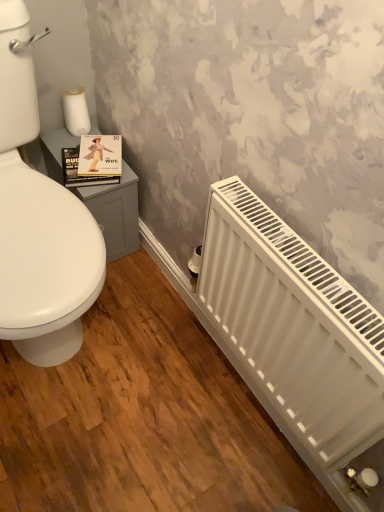
The image size is (384, 512). What do you see at coordinates (294, 325) in the screenshot?
I see `white matte radiator at lower right` at bounding box center [294, 325].

The width and height of the screenshot is (384, 512). What do you see at coordinates (93, 161) in the screenshot?
I see `matte paper book at upper left` at bounding box center [93, 161].

Locate an element on the screen. white matte radiator at lower right is located at coordinates (294, 325).

Consider the image. Is matte paper book at upper left not near white matte toilet paper at upper left?

They are positioned close to each other.

Which of these two, matte paper book at upper left or white matte toilet paper at upper left, stands taller?

white matte toilet paper at upper left is taller.

Between matte paper book at upper left and white matte toilet paper at upper left, which one has smaller width?

white matte toilet paper at upper left.

How much distance is there between matte paper book at upper left and white matte toilet paper at upper left?

A distance of 5.04 inches exists between matte paper book at upper left and white matte toilet paper at upper left.

Is white matte toilet paper at upper left in contact with matte paper book at upper left?

No.

From a real-world perspective, is white matte toilet paper at upper left beneath matte paper book at upper left?

No.

Does white matte toilet paper at upper left turn towards matte paper book at upper left?

Yes, white matte toilet paper at upper left is turned towards matte paper book at upper left.

Locate an element on the screen. toilet paper above the matte paper book at upper left (from the image's perspective) is located at coordinates (76, 111).

Is white matte radiator at lower right not within white matte toilet paper at upper left?

That's correct, white matte radiator at lower right is outside of white matte toilet paper at upper left.

From the image's perspective, does white matte radiator at lower right appear lower than white matte toilet paper at upper left?

Yes, from the image's perspective, white matte radiator at lower right is beneath white matte toilet paper at upper left.

Considering the sizes of objects white matte radiator at lower right and white matte toilet paper at upper left in the image provided, who is thinner, white matte radiator at lower right or white matte toilet paper at upper left?

Thinner between the two is white matte radiator at lower right.

Could you tell me if matte paper book at upper left is turned towards white matte radiator at lower right?

Yes.

Considering the points (81, 142) and (308, 407), which point is behind, point (81, 142) or point (308, 407)?

The point (81, 142) is more distant.

Is matte paper book at upper left outside of white matte radiator at lower right?

Indeed, matte paper book at upper left is completely outside white matte radiator at lower right.

Is matte paper book at upper left in front of white matte radiator at lower right?

That is False.

Is white matte radiator at lower right oriented towards matte paper book at upper left?

No, white matte radiator at lower right is not facing towards matte paper book at upper left.

How far apart are white matte radiator at lower right and matte paper book at upper left?

They are 25.30 inches apart.

What's the angular difference between white matte radiator at lower right and matte paper book at upper left's facing directions?

white matte radiator at lower right and matte paper book at upper left are facing 68.3 degrees away from each other.

Is there a large distance between white matte radiator at lower right and matte paper book at upper left?

Actually, white matte radiator at lower right and matte paper book at upper left are a little close together.

Would you say white matte toilet paper at upper left is outside white matte radiator at lower right?

That's correct, white matte toilet paper at upper left is outside of white matte radiator at lower right.

From the image's perspective, which is below, white matte toilet paper at upper left or white matte radiator at lower right?

From the image's view, white matte radiator at lower right is below.

You are a GUI agent. You are given a task and a screenshot of the screen. Output one action in this format:
    pyautogui.click(x=<x>, y=<y>)
    Task: Click on the toilet paper above the white matte radiator at lower right (from the image's perspective)
    
    Given the screenshot: What is the action you would take?
    pyautogui.click(x=76, y=111)

Is white matte toilet paper at upper left to the left of white matte radiator at lower right from the viewer's perspective?

Yes, white matte toilet paper at upper left is to the left of white matte radiator at lower right.

At what (x,y) coordinates should I click in order to perform the action: click on toilet paper behind the matte paper book at upper left. Please return your answer as a coordinate pair (x, y). Looking at the image, I should click on (76, 111).

Locate an element on the screen. toilet paper that is above the matte paper book at upper left (from the image's perspective) is located at coordinates (76, 111).

When comparing their distances from white matte toilet paper at upper left, does white matte radiator at lower right or matte paper book at upper left seem further?

white matte radiator at lower right is further to white matte toilet paper at upper left.

When comparing their distances from matte paper book at upper left, does white matte toilet paper at upper left or white matte radiator at lower right seem closer?

white matte toilet paper at upper left is closer to matte paper book at upper left.

Based on their spatial positions, is white matte radiator at lower right or white matte toilet paper at upper left further from matte paper book at upper left?

white matte radiator at lower right is further to matte paper book at upper left.

Considering their positions, is matte paper book at upper left positioned closer to white matte radiator at lower right than white matte toilet paper at upper left?

matte paper book at upper left.

From the picture: When comparing their distances from white matte radiator at lower right, does white matte toilet paper at upper left or matte paper book at upper left seem closer?

matte paper book at upper left is positioned closer to the anchor white matte radiator at lower right.

Based on their spatial positions, is matte paper book at upper left or white matte radiator at lower right further from white matte toilet paper at upper left?

white matte radiator at lower right lies further to white matte toilet paper at upper left than the other object.

You are a GUI agent. You are given a task and a screenshot of the screen. Output one action in this format:
    pyautogui.click(x=<x>, y=<y>)
    Task: Click on the book cover located between white matte radiator at lower right and white matte toilet paper at upper left in the depth direction
    
    Given the screenshot: What is the action you would take?
    pyautogui.click(x=93, y=161)